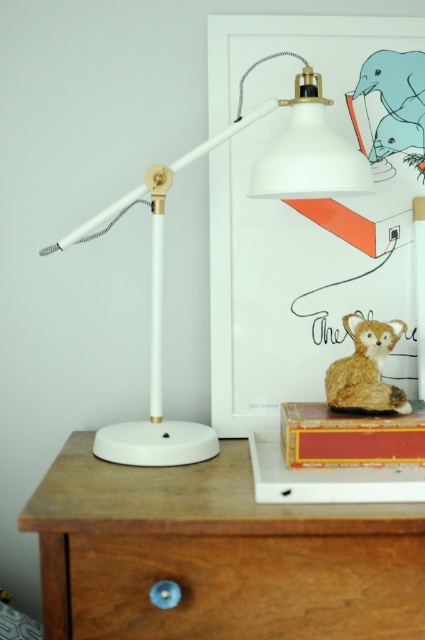
You are a person who wants to place a small book on the wooden drawer at center without disturbing the fuzzy brown cat at upper right. Is the drawer accessible for placing the book?

The wooden drawer at center is positioned under the fuzzy brown cat at upper right, so the drawer is accessible for placing the book as long as the cat remains undisturbed.

You are organizing a small toy that is 10 cm tall. You want to place it on either the wooden drawer at lower center or the fuzzy brown cat at upper right. Which surface can accommodate the toy without it hanging off?

The fuzzy brown cat at upper right is taller than the wooden drawer at lower center. Since the toy is 10 cm tall, it can be placed on the fuzzy brown cat at upper right as it has enough height to support the toy without it hanging off.